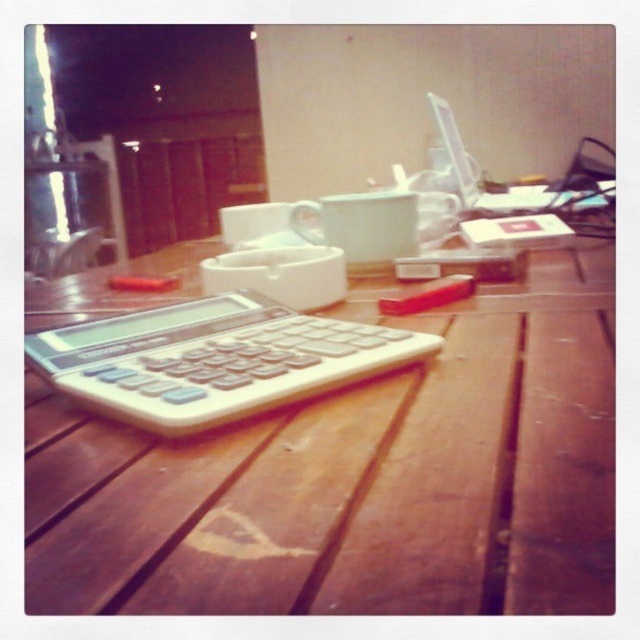
You are standing at the origin point of the coordinate system. Can you determine the position of the wooden table at center relative to your current location?

The wooden table at center is located at point (x=346, y=472), which means it is positioned to the right and slightly forward from your current position at the origin.

You are looking at the wooden table and notice two points marked on the table surface. The first point is at coordinates point (180, 358) and the second is at point (160, 372). Which point is closer to you?

Point (180, 358) is further to the camera than point (160, 372), so the point closer to you is point (160, 372).

You are trying to place a book on the wooden table at center. However, the white plastic calculator at center is currently occupying the space. Can the book be placed on the table without moving the calculator?

The wooden table at center is taller than the white plastic calculator at center, so yes, the book can be placed on the wooden table at center as there is enough vertical space above the calculator to accommodate it.